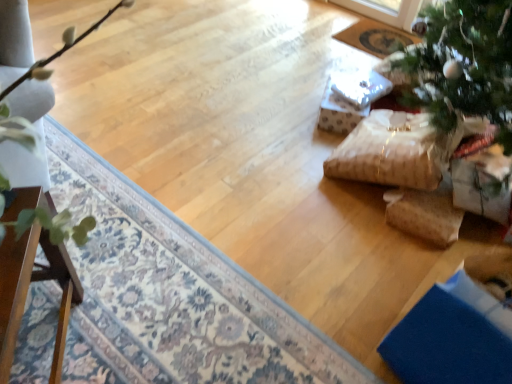
You are a GUI agent. You are given a task and a screenshot of the screen. Output one action in this format:
    pyautogui.click(x=<x>, y=<y>)
    Task: Click on the wooden coffee table at lower left
    The width and height of the screenshot is (512, 384).
    Given the screenshot: What is the action you would take?
    pyautogui.click(x=27, y=291)

Describe the element at coordinates (27, 291) in the screenshot. I see `wooden coffee table at lower left` at that location.

This screenshot has height=384, width=512. What are the coordinates of `wooden coffee table at lower left` in the screenshot? It's located at (27, 291).